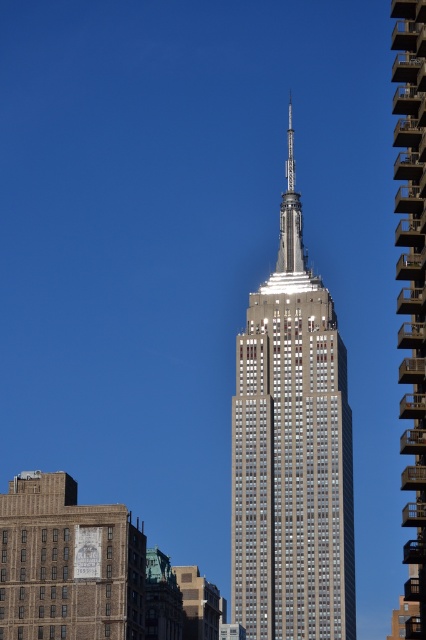
Question: Which point is closer to the camera taking this photo?

Choices:
 (A) (305, 388)
 (B) (417, 188)

Answer: (B)

Question: Can you confirm if silver metallic building at center is thinner than glassy steel building at center?

Choices:
 (A) yes
 (B) no

Answer: (A)

Question: Is silver metallic building at center positioned at the back of glassy steel building at center?

Choices:
 (A) no
 (B) yes

Answer: (B)

Question: Is silver metallic building at center wider than glassy steel building at center?

Choices:
 (A) no
 (B) yes

Answer: (A)